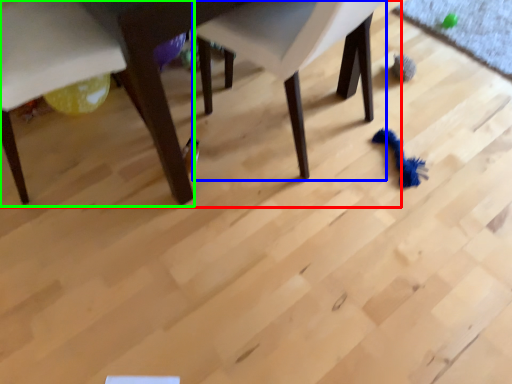
Question: Which object is the farthest from table (highlighted by a red box)? Choose among these: chair (highlighted by a blue box) or chair (highlighted by a green box).

Choices:
 (A) chair
 (B) chair

Answer: (A)